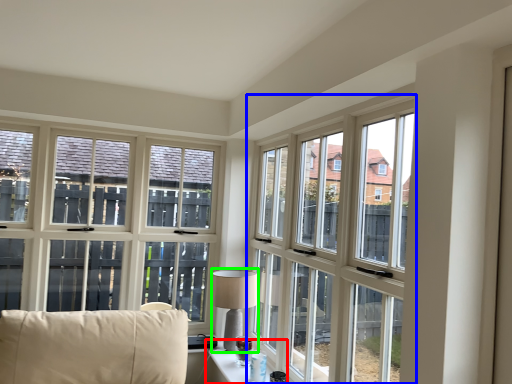
Question: Which is farther away from table (highlighted by a red box)? window (highlighted by a blue box) or table lamp (highlighted by a green box)?

Choices:
 (A) window
 (B) table lamp

Answer: (A)